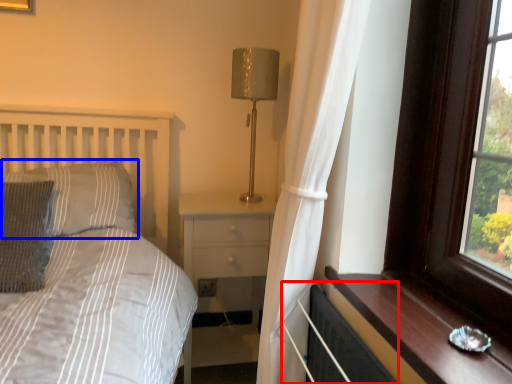
Question: Which point is further to the camera, radiator (highlighted by a red box) or pillow (highlighted by a blue box)?

Choices:
 (A) radiator
 (B) pillow

Answer: (B)